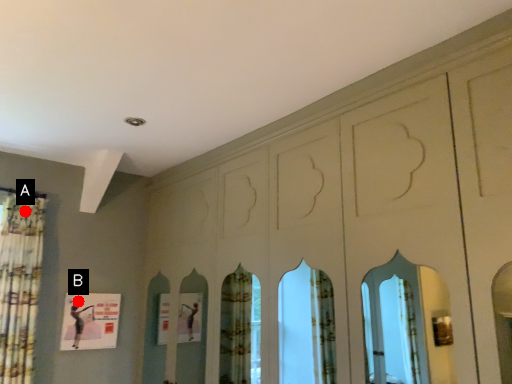
Question: Two points are circled on the image, labeled by A and B beside each circle. Which of the following is the farthest from the observer?

Choices:
 (A) A is further
 (B) B is further

Answer: (B)